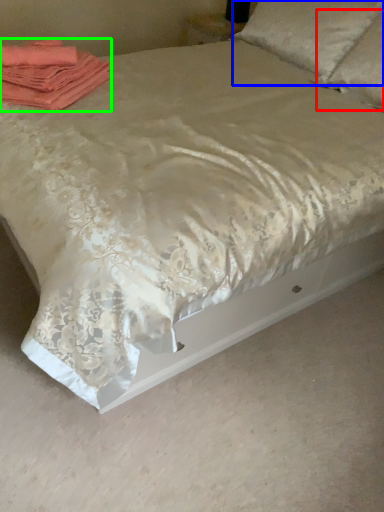
Question: Estimate the real-world distances between objects in this image. Which object is closer to pillow (highlighted by a red box), pillow (highlighted by a blue box) or material (highlighted by a green box)?

Choices:
 (A) pillow
 (B) material

Answer: (A)